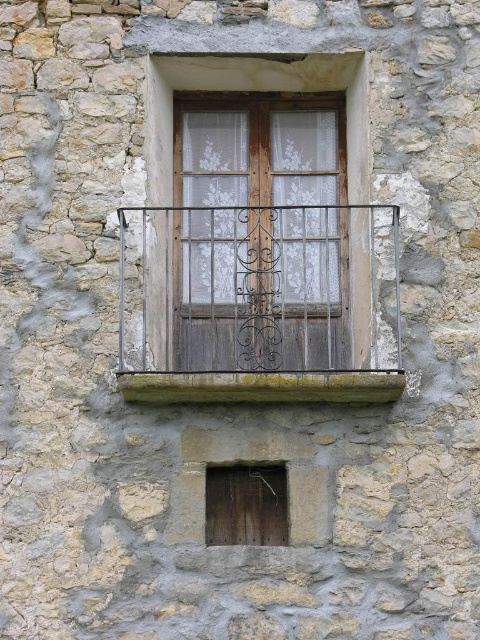
Where is the wooden frame at center located in the image?

The wooden frame at center is located at point (x=252, y=90) in the image.

You are standing in front of the rustic stone building and want to place a small potted plant on the dark brown wrought iron balcony at center. However, you notice the green mossy wood at lower center nearby. Which object is positioned to the left of the other?

The dark brown wrought iron balcony at center is to the left of the green mossy wood at lower center.

You are a painter who needs to decide which object to paint first between the wooden frame at center and the green mossy wood at lower center. Based on their sizes, which one requires more paint?

The wooden frame at center has a larger size compared to green mossy wood at lower center, so it requires more paint.